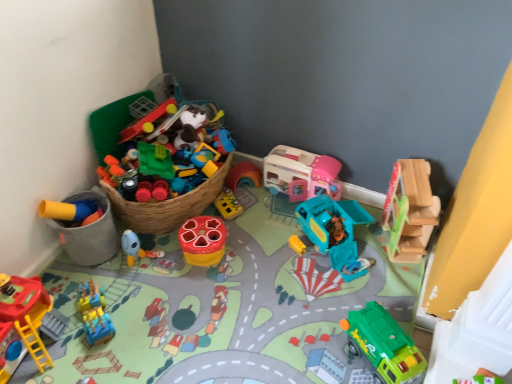
Locate an element on the screen. free point behind blue plastic train at lower left, acting as the seventh toy starting from the right is located at coordinates (114, 276).